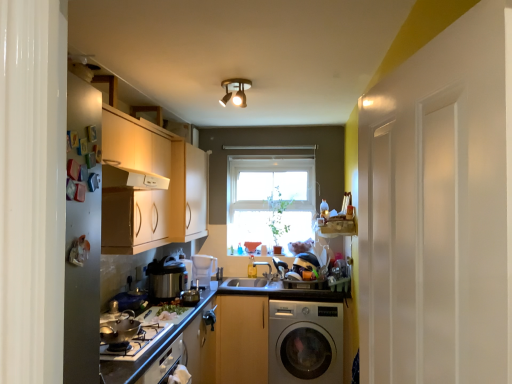
At what (x,y) coordinates should I click in order to perform the action: click on empty space that is ontop of clear glass window at center. Please return your answer as a coordinate pair (x, y). Looking at the image, I should click on (270, 154).